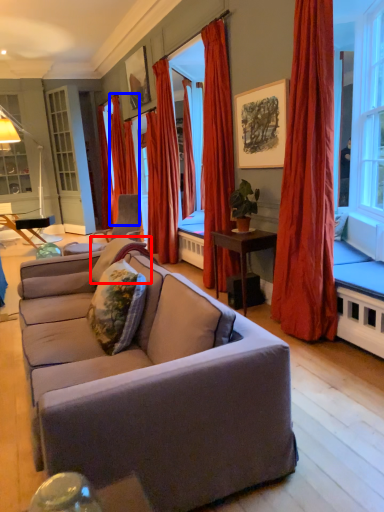
Question: Which object is further to the camera taking this photo, pillow (highlighted by a red box) or curtain (highlighted by a blue box)?

Choices:
 (A) pillow
 (B) curtain

Answer: (B)